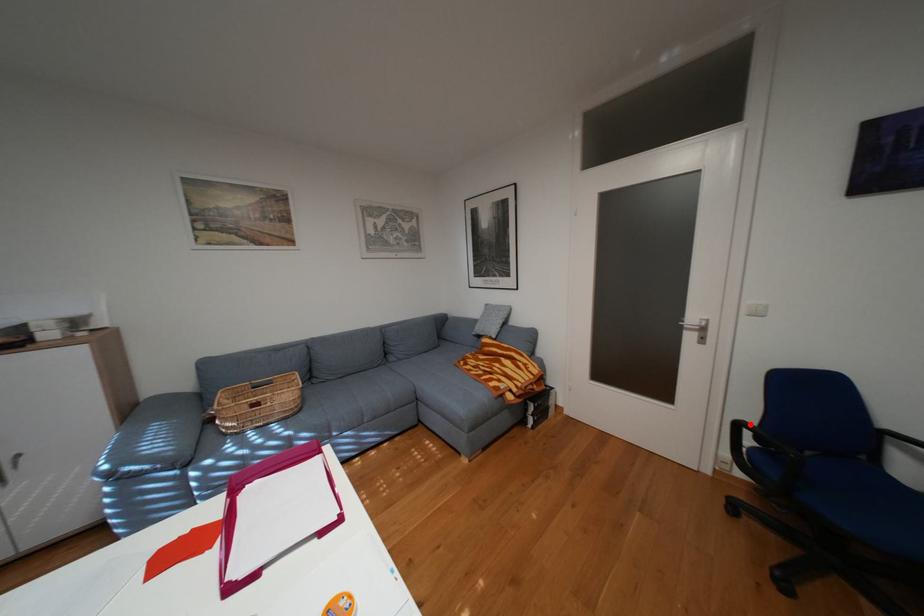
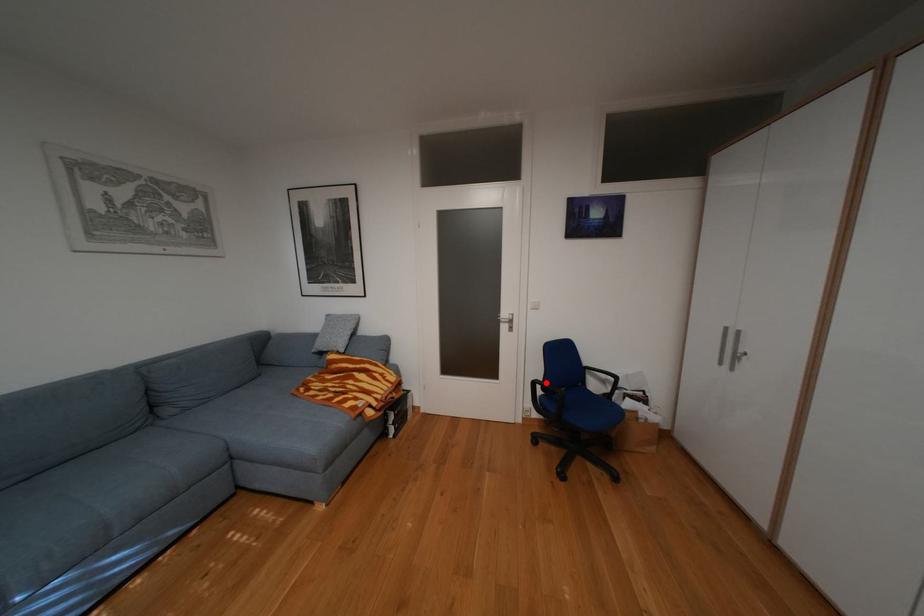
I am providing you with two images of the same scene from different viewpoints. A red point is marked on the first image and another point is marked on the second image. Do the highlighted points in image1 and image2 indicate the same real-world spot?

Yes